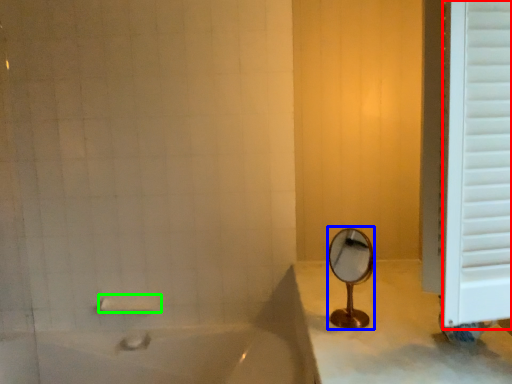
Question: Estimate the real-world distances between objects in this image. Which object is closer to window frame (highlighted by a red box), mirror (highlighted by a blue box) or towel bar (highlighted by a green box)?

Choices:
 (A) mirror
 (B) towel bar

Answer: (A)